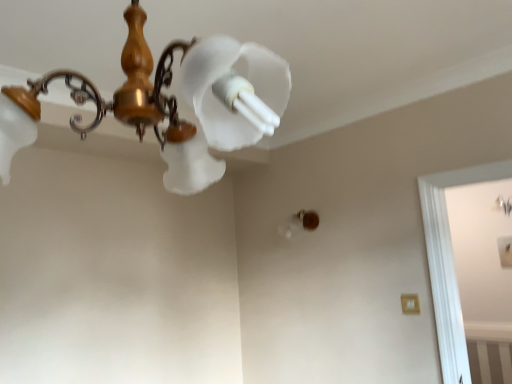
The height and width of the screenshot is (384, 512). What do you see at coordinates (168, 102) in the screenshot?
I see `matte white chandelier at upper center` at bounding box center [168, 102].

You are a GUI agent. You are given a task and a screenshot of the screen. Output one action in this format:
    pyautogui.click(x=<x>, y=<y>)
    Task: Click on the matte white chandelier at upper center
    The width and height of the screenshot is (512, 384).
    Given the screenshot: What is the action you would take?
    pyautogui.click(x=168, y=102)

Where is `matte white chandelier at upper center`? matte white chandelier at upper center is located at coordinates (168, 102).